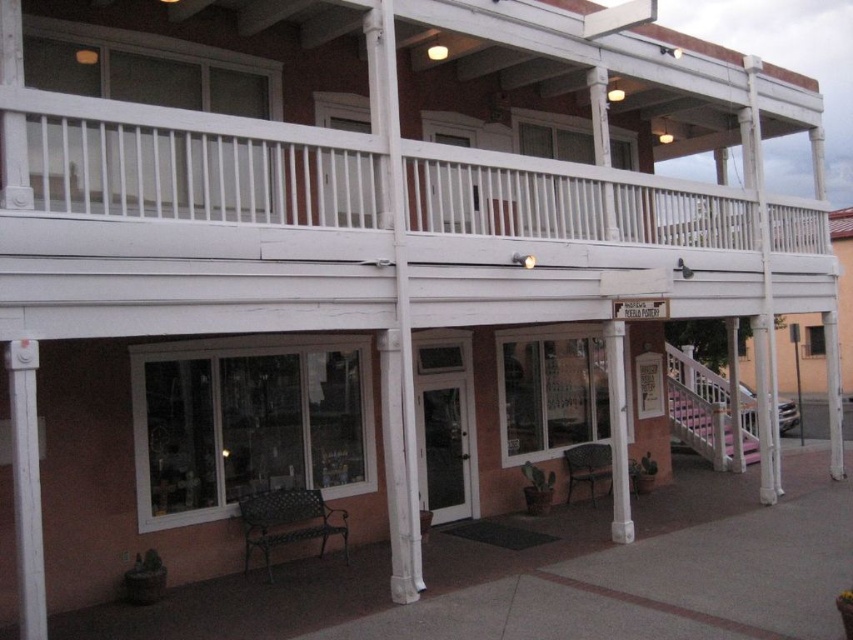
Question: Where is white painted wood at left located in relation to white painted wood at right in the image?

Choices:
 (A) above
 (B) below

Answer: (A)

Question: Which of the following is the closest to the observer?

Choices:
 (A) white wooden railing at upper center
 (B) white painted wood at right

Answer: (A)

Question: Can you confirm if white wooden railing at upper center is positioned above white painted wood at left?

Choices:
 (A) yes
 (B) no

Answer: (A)

Question: From the image, what is the correct spatial relationship of white painted wood column at center in relation to white painted wood at right?

Choices:
 (A) above
 (B) below

Answer: (A)

Question: Which point appears farthest from the camera in this image?

Choices:
 (A) (144, 182)
 (B) (614, 460)
 (C) (28, 628)

Answer: (B)

Question: Which object is closer to the camera taking this photo?

Choices:
 (A) white wooden railing at upper center
 (B) white painted wood at left
 (C) white painted wood at right
 (D) white painted wood column at center

Answer: (B)